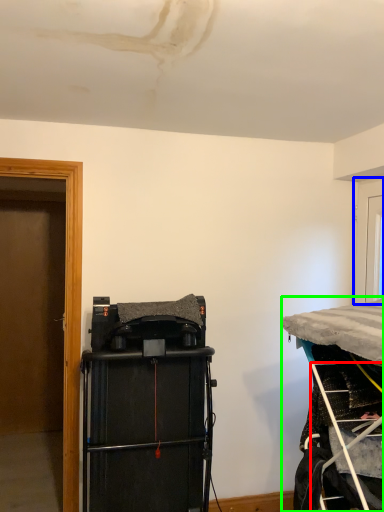
Question: Which object is positioned farthest from ladder (highlighted by a red box)? Select from door (highlighted by a blue box) and furniture (highlighted by a green box).

Choices:
 (A) door
 (B) furniture

Answer: (A)